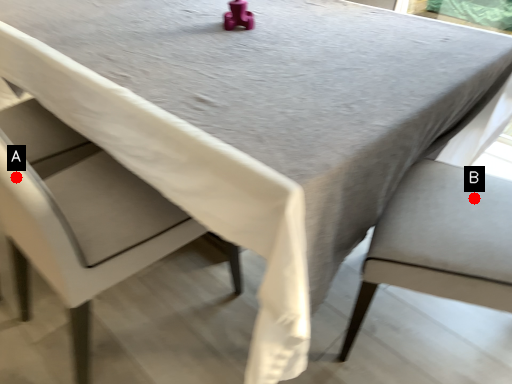
Question: Two points are circled on the image, labeled by A and B beside each circle. Which of the following is the farthest from the observer?

Choices:
 (A) A is further
 (B) B is further

Answer: (B)